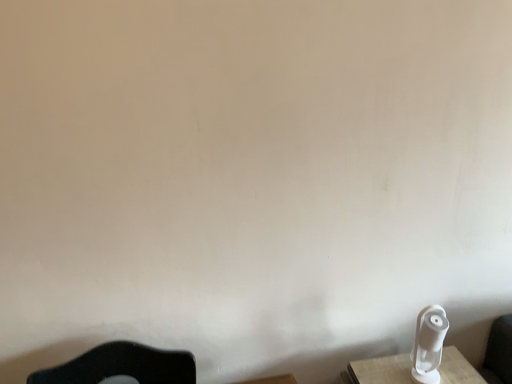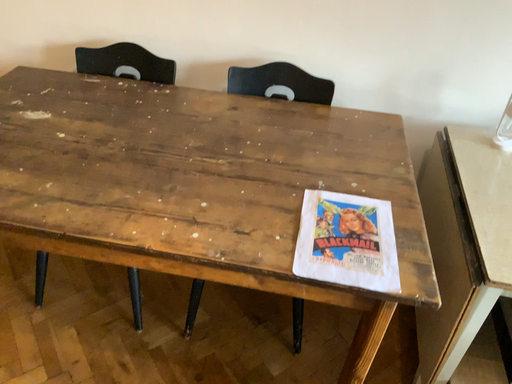
Question: How did the camera likely rotate when shooting the video?

Choices:
 (A) rotated right
 (B) rotated left

Answer: (B)